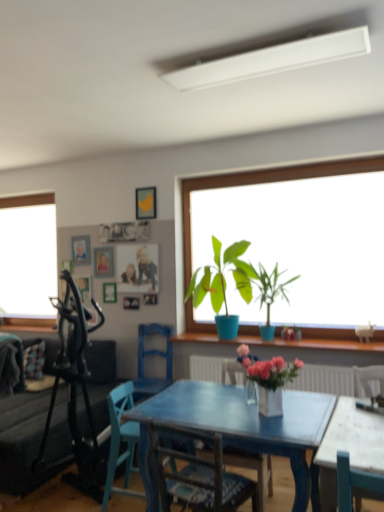
What do you see at coordinates (223, 281) in the screenshot?
I see `green matte plant at center, the first houseplant in the left-to-right sequence` at bounding box center [223, 281].

The width and height of the screenshot is (384, 512). In order to click on wooden chair at center, marked as the 3th chair in a back-to-front arrangement in this screenshot , I will do `click(253, 469)`.

In order to face green matte plant at center, placed as the 1th houseplant when sorted from right to left, should I rotate leftwards or rightwards?

Turn right by 9.696 degrees to look at green matte plant at center, placed as the 1th houseplant when sorted from right to left.

What do you see at coordinates (81, 250) in the screenshot? This screenshot has width=384, height=512. I see `metallic gold picture frame at upper center, the 1th picture frame in the back-to-front sequence` at bounding box center [81, 250].

The image size is (384, 512). Find the location of `teal wooden chair at center, which appears as the 3th chair when viewed from the front`. teal wooden chair at center, which appears as the 3th chair when viewed from the front is located at coordinates pyautogui.click(x=121, y=441).

How many degrees apart are the facing directions of blue wooden chair at center, the 4th chair viewed from the front, and white matte vase at center?

The facing directions of blue wooden chair at center, the 4th chair viewed from the front, and white matte vase at center are 39.5 degrees apart.

Measure the distance from blue wooden chair at center, the 4th chair viewed from the front, to white matte vase at center.

A distance of 6.58 feet exists between blue wooden chair at center, the 4th chair viewed from the front, and white matte vase at center.

From the image's perspective, is blue wooden chair at center, which is the first chair from back to front, located beneath white matte vase at center?

Correct, blue wooden chair at center, which is the first chair from back to front, appears lower than white matte vase at center in the image.

Does blue wooden chair at center, which is the first chair from back to front, contain white matte vase at center?

Actually, white matte vase at center is outside blue wooden chair at center, which is the first chair from back to front.

Which of these two, wooden picture frame at upper center, which ranks as the second picture frame in back-to-front order, or white marble table at lower right, is wider?

With larger width is white marble table at lower right.

Where is `the 3rd picture frame to the left of the white marble table at lower right, counting from the anchor's position`? This screenshot has width=384, height=512. the 3rd picture frame to the left of the white marble table at lower right, counting from the anchor's position is located at coordinates (103, 262).

Is wooden picture frame at upper center, the 2th picture frame ordered from the bottom, looking in the opposite direction of white marble table at lower right?

No, white marble table at lower right is not at the back of wooden picture frame at upper center, the 2th picture frame ordered from the bottom.

From a real-world perspective, which object rests below the other?

white marble table at lower right, from a real-world perspective.

From the image's perspective, starting from the teal wooden chair at center, the second chair viewed from the back, which chair is the 1st one above? Please provide its 2D coordinates.

[(253, 469)]

Between teal wooden chair at center, the second chair viewed from the back, and wooden chair at center, placed as the 2th chair when sorted from front to back, which one is positioned behind?

teal wooden chair at center, the second chair viewed from the back, is more distant.

Which object is positioned more to the right, teal wooden chair at center, which appears as the 3th chair when viewed from the front, or wooden chair at center, marked as the 3th chair in a back-to-front arrangement?

From the viewer's perspective, wooden chair at center, marked as the 3th chair in a back-to-front arrangement, appears more on the right side.

Between wooden picture frame at upper center, the 4th picture frame from the back, and teal wooden chair at center, which appears as the 3th chair when viewed from the front, which one has less height?

wooden picture frame at upper center, the 4th picture frame from the back.

From a real-world perspective, does wooden picture frame at upper center, placed as the 1th picture frame when sorted from right to left, stand above teal wooden chair at center, the second chair viewed from the back?

Yes, from a real-world perspective, wooden picture frame at upper center, placed as the 1th picture frame when sorted from right to left, is on top of teal wooden chair at center, the second chair viewed from the back.

Locate an element on the screen. This screenshot has width=384, height=512. picture frame that is the 1st one when counting backward from the teal wooden chair at center, the second chair viewed from the back is located at coordinates (146, 203).

Considering the sizes of objects wooden picture frame at upper center, the fourth picture frame in the left-to-right sequence, and teal wooden chair at center, the second chair viewed from the back, in the image provided, who is smaller, wooden picture frame at upper center, the fourth picture frame in the left-to-right sequence, or teal wooden chair at center, the second chair viewed from the back,?

Smaller between the two is wooden picture frame at upper center, the fourth picture frame in the left-to-right sequence.

Visually, is dark gray fabric couch at left positioned to the left or to the right of white matte rectangular light fixture at upper center?

From the image, it's evident that dark gray fabric couch at left is to the left of white matte rectangular light fixture at upper center.

Which of these two, dark gray fabric couch at left or white matte rectangular light fixture at upper center, is thinner?

white matte rectangular light fixture at upper center.

Is dark gray fabric couch at left spatially inside white matte rectangular light fixture at upper center, or outside of it?

dark gray fabric couch at left lies outside white matte rectangular light fixture at upper center.

From the image's perspective, which one is positioned lower, white marble table at lower right or metallic gold picture frame at upper center, which is the 1th picture frame in left-to-right order?

→ white marble table at lower right.

Does white marble table at lower right turn towards metallic gold picture frame at upper center, arranged as the fourth picture frame when viewed from the right?

No, white marble table at lower right does not turn towards metallic gold picture frame at upper center, arranged as the fourth picture frame when viewed from the right.

Can you confirm if white marble table at lower right is positioned to the left of metallic gold picture frame at upper center, arranged as the fourth picture frame when viewed from the right?

No, white marble table at lower right is not to the left of metallic gold picture frame at upper center, arranged as the fourth picture frame when viewed from the right.

Considering the relative sizes of white marble table at lower right and metallic gold picture frame at upper center, which is the 1th picture frame in left-to-right order, in the image provided, is white marble table at lower right wider than metallic gold picture frame at upper center, which is the 1th picture frame in left-to-right order,?

Indeed, white marble table at lower right has a greater width compared to metallic gold picture frame at upper center, which is the 1th picture frame in left-to-right order.

In the image, is white matte vase at center positioned in front of or behind white matte rectangular light fixture at upper center?

white matte vase at center is positioned farther from the viewer than white matte rectangular light fixture at upper center.

Considering the points (266, 378) and (183, 78), which point is in front, point (266, 378) or point (183, 78)?

The point (266, 378) is more forward.

Can you tell me how much white matte vase at center and white matte rectangular light fixture at upper center differ in facing direction?

43.1 degrees.

From the image's perspective, which is above, white matte vase at center or white matte rectangular light fixture at upper center?

white matte rectangular light fixture at upper center is shown above in the image.

I want to click on the 1st chair positioned below the white matte vase at center (from the image's perspective), so click(150, 355).

Locate an element on the screen. The height and width of the screenshot is (512, 384). table below the wooden picture frame at upper center, which is counted as the 3th picture frame, starting from the right (from a real-world perspective) is located at coordinates (348, 447).

Based on their spatial positions, is wooden chair at center, placed as the 2th chair when sorted from front to back, or green matte plant at center, which is the 2th houseplant from left to right, further from wooden picture frame at upper center, positioned as the 2th picture frame in right-to-left order?

wooden chair at center, placed as the 2th chair when sorted from front to back.

From the image, which object appears to be farther from white matte vase at center, wooden picture frame at upper center, which ranks as the 1th picture frame in bottom-to-top order, or green matte plant at center, placed as the 1th houseplant when sorted from right to left?

wooden picture frame at upper center, which ranks as the 1th picture frame in bottom-to-top order, is further to white matte vase at center.

Which object lies nearer to the anchor point white matte rectangular light fixture at upper center, wooden chair at center, the first chair when ordered from front to back, or wooden picture frame at upper center, positioned as the 2th picture frame in right-to-left order?

wooden chair at center, the first chair when ordered from front to back, is positioned closer to the anchor white matte rectangular light fixture at upper center.

Considering their positions, is wooden picture frame at upper center, the third picture frame in the front-to-back sequence, positioned closer to white marble table at lower right than blue wooden chair at center, which is the first chair from back to front?

blue wooden chair at center, which is the first chair from back to front, is positioned closer to the anchor white marble table at lower right.

Based on their spatial positions, is blue wooden chair at center, the 4th chair viewed from the front, or dark gray fabric couch at left closer to teal wooden chair at center, the second chair viewed from the back?

dark gray fabric couch at left.

Based on their spatial positions, is wooden picture frame at upper center, positioned as the 2th picture frame in right-to-left order, or dark gray fabric couch at left further from white matte rectangular light fixture at upper center?

Based on the image, wooden picture frame at upper center, positioned as the 2th picture frame in right-to-left order, appears to be further to white matte rectangular light fixture at upper center.

Based on the photo, which object lies nearer to the anchor point white matte rectangular light fixture at upper center, white matte vase at center or wooden picture frame at upper center, positioned as the 2th picture frame in right-to-left order?

white matte vase at center.

Considering their positions, is white marble table at lower right positioned closer to teal wooden chair at center, which appears as the 3th chair when viewed from the front, than metallic gold picture frame at upper center, which is the 2th picture frame from top to bottom?

white marble table at lower right.

I want to click on picture frame positioned between white matte rectangular light fixture at upper center and wooden picture frame at upper center, which ranks as the 1th picture frame in bottom-to-top order, from near to far, so point(146,203).

Where is `floral arrangement between white marble table at lower right and green matte plant at center, the first houseplant in the left-to-right sequence, from front to back`? Image resolution: width=384 pixels, height=512 pixels. floral arrangement between white marble table at lower right and green matte plant at center, the first houseplant in the left-to-right sequence, from front to back is located at coordinates (268, 379).

The height and width of the screenshot is (512, 384). Find the location of `studio couch between white marble table at lower right and wooden picture frame at upper center, positioned as the 2th picture frame in right-to-left order, along the z-axis`. studio couch between white marble table at lower right and wooden picture frame at upper center, positioned as the 2th picture frame in right-to-left order, along the z-axis is located at coordinates (23, 441).

Locate an element on the screen. floral arrangement between white matte rectangular light fixture at upper center and wooden picture frame at upper center, the 4th picture frame from the back, in the front-back direction is located at coordinates (268, 379).